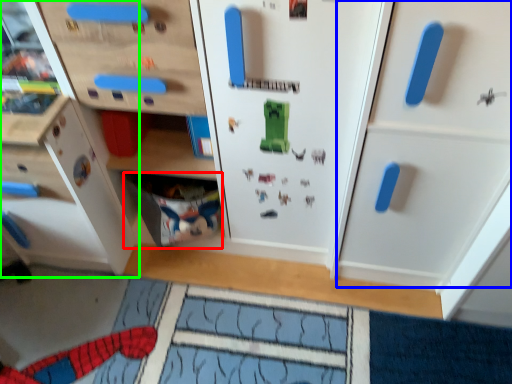
Question: Considering the real-world distances, which object is closest to drawer (highlighted by a red box)? cabinetry (highlighted by a blue box) or cabinetry (highlighted by a green box).

Choices:
 (A) cabinetry
 (B) cabinetry

Answer: (B)